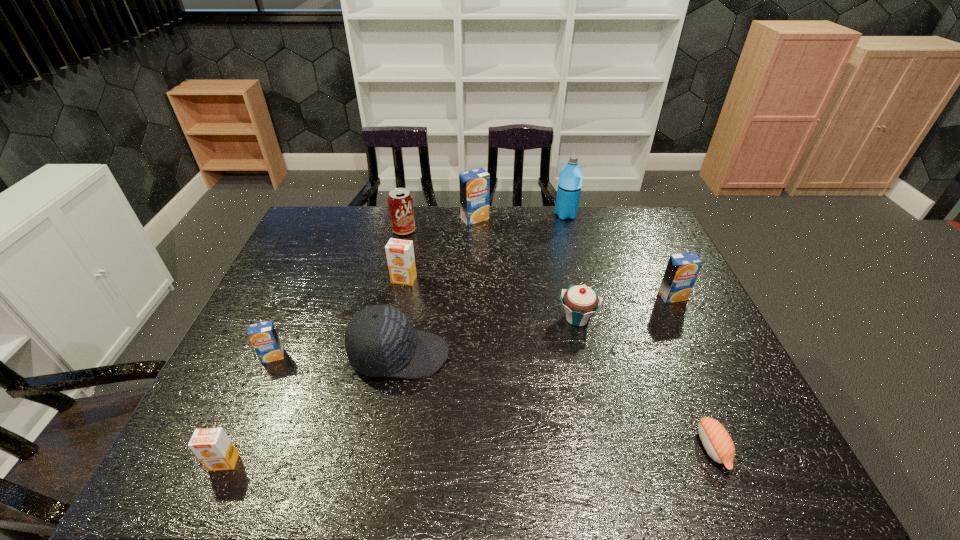
Where is `orange juice that is the second closest to the soda can`? Image resolution: width=960 pixels, height=540 pixels. orange juice that is the second closest to the soda can is located at coordinates (400, 253).

Select which blue orange_juice is the second closest to the farthest blue orange_juice. Please provide its 2D coordinates. Your answer should be formatted as a tuple, i.e. [(x, y)], where the tuple contains the x and y coordinates of a point satisfying the conditions above.

[(263, 336)]

Identify the location of the second closest blue orange_juice to the nearest blue orange_juice. The height and width of the screenshot is (540, 960). (682, 270).